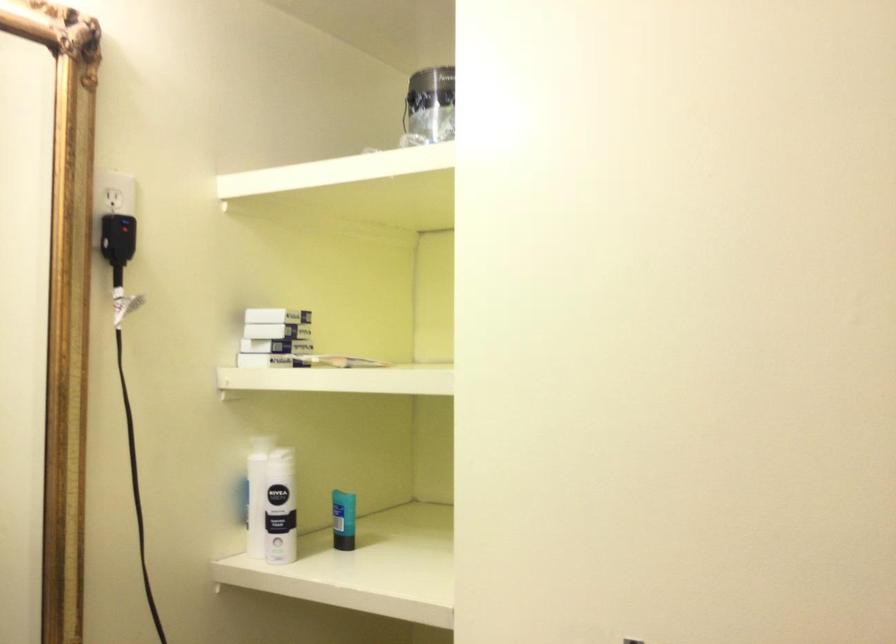
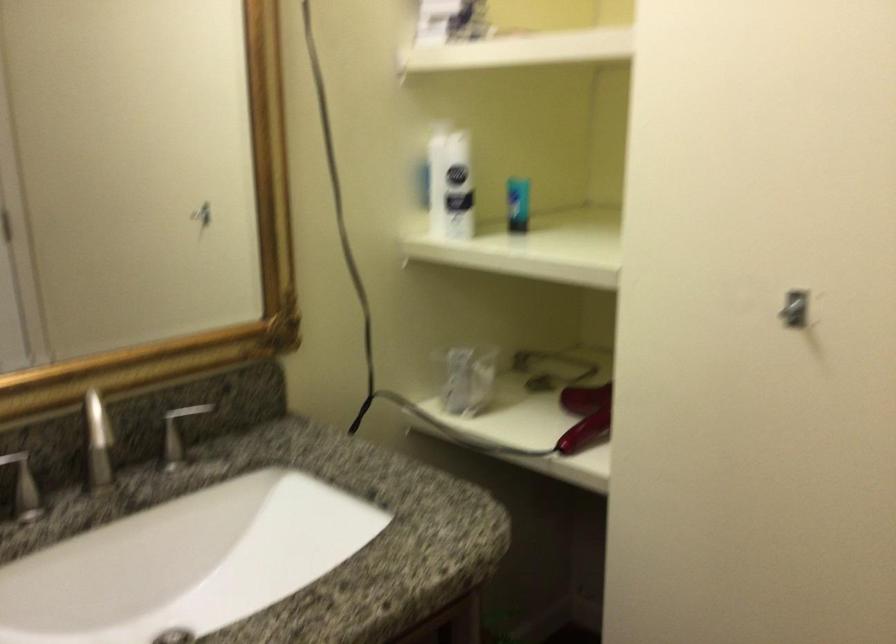
Which direction would the cameraman need to move to produce the second image?

The movement direction of the cameraman is right, backward.